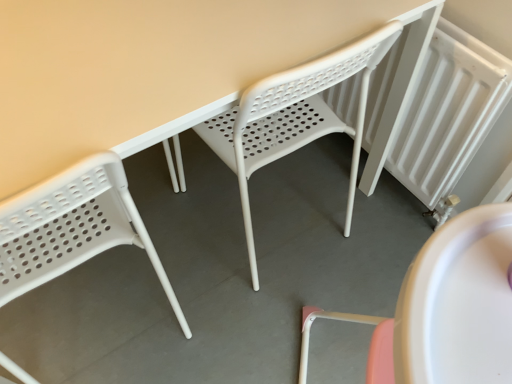
This screenshot has width=512, height=384. Find the location of `vacant area situated below white plastic chair at left, which is counted as the 2th chair, starting from the right (from a real-world perspective)`. vacant area situated below white plastic chair at left, which is counted as the 2th chair, starting from the right (from a real-world perspective) is located at coordinates (108, 307).